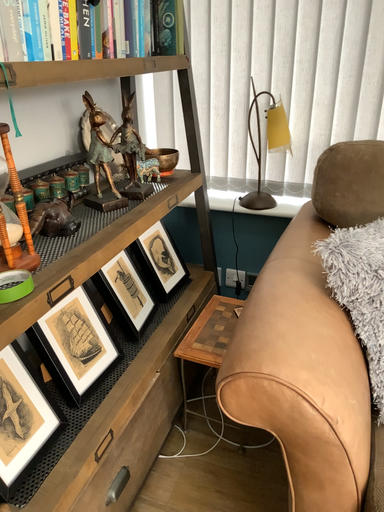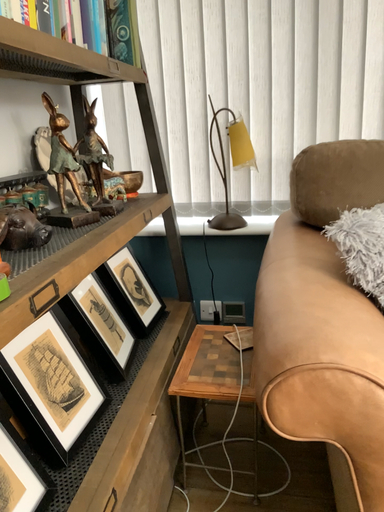
Question: How did the camera likely rotate when shooting the video?

Choices:
 (A) rotated downward
 (B) rotated upward

Answer: (B)